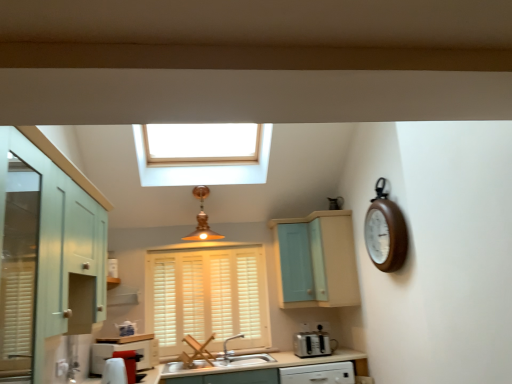
Question: From the image's perspective, would you say white wood blinds at center is positioned over wooden clock at right?

Choices:
 (A) no
 (B) yes

Answer: (A)

Question: Is white wood blinds at center at the left side of wooden clock at right?

Choices:
 (A) yes
 (B) no

Answer: (A)

Question: Is white wood blinds at center not close to wooden clock at right?

Choices:
 (A) yes
 (B) no

Answer: (A)

Question: Is white wood blinds at center not within wooden clock at right?

Choices:
 (A) yes
 (B) no

Answer: (A)

Question: From a real-world perspective, is white wood blinds at center below wooden clock at right?

Choices:
 (A) no
 (B) yes

Answer: (B)

Question: Is satin silver toaster at lower center in front of or behind white glossy oven at lower left in the image?

Choices:
 (A) front
 (B) behind

Answer: (B)

Question: Considering the relative positions of satin silver toaster at lower center and white glossy oven at lower left in the image provided, is satin silver toaster at lower center to the left or to the right of white glossy oven at lower left?

Choices:
 (A) right
 (B) left

Answer: (A)

Question: From a real-world perspective, is satin silver toaster at lower center physically located above or below white glossy oven at lower left?

Choices:
 (A) above
 (B) below

Answer: (B)

Question: Is satin silver toaster at lower center wider or thinner than white glossy oven at lower left?

Choices:
 (A) thin
 (B) wide

Answer: (B)

Question: From the image's perspective, relative to satin nickel faucet at sink center, is white wood blinds at center above or below?

Choices:
 (A) above
 (B) below

Answer: (A)

Question: Considering the positions of white wood blinds at center and satin nickel faucet at sink center in the image, is white wood blinds at center wider or thinner than satin nickel faucet at sink center?

Choices:
 (A) wide
 (B) thin

Answer: (B)

Question: From their relative heights in the image, would you say white wood blinds at center is taller or shorter than satin nickel faucet at sink center?

Choices:
 (A) short
 (B) tall

Answer: (B)

Question: Considering their positions, is white wood blinds at center located in front of or behind satin nickel faucet at sink center?

Choices:
 (A) front
 (B) behind

Answer: (B)

Question: Relative to white ceramic sink at center, is satin nickel faucet at sink center in front or behind?

Choices:
 (A) front
 (B) behind

Answer: (B)

Question: From a real-world perspective, is satin nickel faucet at sink center above or below white ceramic sink at center?

Choices:
 (A) above
 (B) below

Answer: (A)